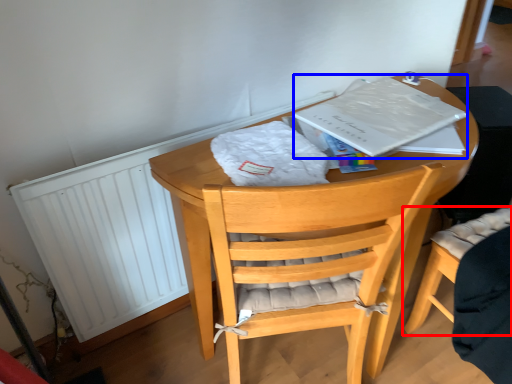
Question: Which object appears farthest to the camera in this image, chair (highlighted by a red box) or paperback book (highlighted by a blue box)?

Choices:
 (A) chair
 (B) paperback book

Answer: (B)